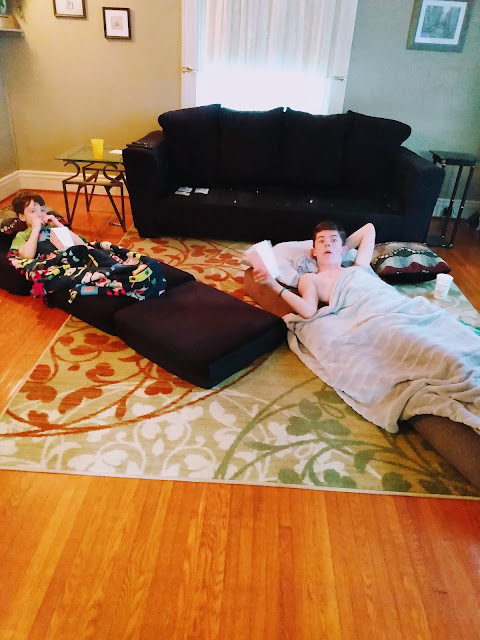
Identify the location of end tables. The width and height of the screenshot is (480, 640). (459, 150), (111, 159).